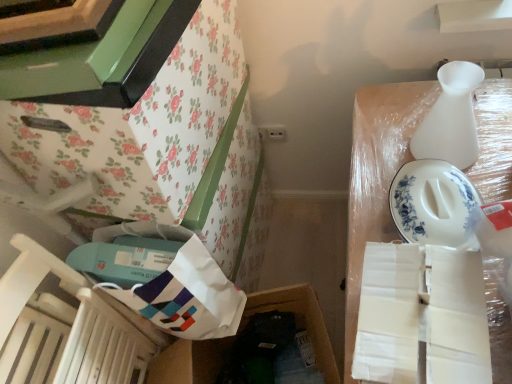
Question: Is white cardboard box at upper right, acting as the 2th storage box starting from the left, outside white matte vase at upper right?

Choices:
 (A) yes
 (B) no

Answer: (A)

Question: From a real-world perspective, is white cardboard box at upper right, which is counted as the 1th storage box, starting from the right, on white matte vase at upper right?

Choices:
 (A) yes
 (B) no

Answer: (B)

Question: From the image's perspective, is white cardboard box at upper right, which is counted as the 1th storage box, starting from the right, under white matte vase at upper right?

Choices:
 (A) yes
 (B) no

Answer: (A)

Question: From the image's perspective, is white cardboard box at upper right, which is counted as the 1th storage box, starting from the right, above white matte vase at upper right?

Choices:
 (A) yes
 (B) no

Answer: (B)

Question: Can white matte vase at upper right be found inside white cardboard box at upper right, which is counted as the 1th storage box, starting from the right?

Choices:
 (A) yes
 (B) no

Answer: (B)

Question: Is point [x=68, y=354] closer or farther from the camera than point [x=167, y=329]?

Choices:
 (A) farther
 (B) closer

Answer: (B)

Question: Would you say wooden chair at lower left is to the left or to the right of white paper bag at lower left, the first wrapping paper positioned from the left, in the picture?

Choices:
 (A) right
 (B) left

Answer: (B)

Question: From a real-world perspective, relative to white paper bag at lower left, the first wrapping paper positioned from the left, is wooden chair at lower left vertically above or below?

Choices:
 (A) above
 (B) below

Answer: (B)

Question: From the image's perspective, relative to white paper bag at lower left, positioned as the second wrapping paper in front-to-back order, is wooden chair at lower left above or below?

Choices:
 (A) above
 (B) below

Answer: (B)

Question: Is point (445, 119) positioned closer to the camera than point (160, 155)?

Choices:
 (A) farther
 (B) closer

Answer: (A)

Question: Relative to floral paper-covered cabinet at upper left, is white matte vase at upper right in front or behind?

Choices:
 (A) front
 (B) behind

Answer: (B)

Question: Is white matte vase at upper right bigger or smaller than floral paper-covered cabinet at upper left?

Choices:
 (A) small
 (B) big

Answer: (A)

Question: Would you say white matte vase at upper right is to the left or to the right of floral paper-covered cabinet at upper left in the picture?

Choices:
 (A) left
 (B) right

Answer: (B)

Question: Relative to white paper bag at lower left, the first wrapping paper positioned from the left, is floral paper-covered cabinet at upper left in front or behind?

Choices:
 (A) front
 (B) behind

Answer: (A)

Question: Considering the positions of floral paper-covered cabinet at upper left and white paper bag at lower left, positioned as the second wrapping paper in front-to-back order, in the image, is floral paper-covered cabinet at upper left taller or shorter than white paper bag at lower left, positioned as the second wrapping paper in front-to-back order,?

Choices:
 (A) tall
 (B) short

Answer: (A)